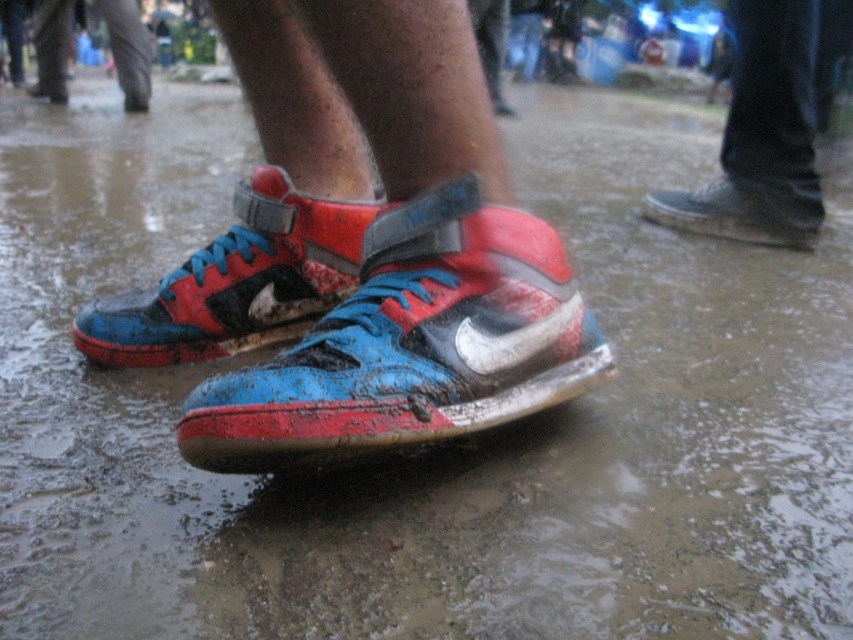
Between shiny leather sneakers at center and blue matte/suede sneaker at center, which one is positioned lower?

shiny leather sneakers at center is lower down.

Where is `shiny leather sneakers at center`? This screenshot has width=853, height=640. shiny leather sneakers at center is located at coordinates (412, 344).

Who is more distant from viewer, (x=372, y=221) or (x=231, y=333)?

The point (x=231, y=333) is behind.

Locate an element on the screen. shiny leather sneakers at center is located at coordinates [412, 344].

Is shiny leather sneakers at center smaller than blue suede shoe at upper right?

Incorrect, shiny leather sneakers at center is not smaller in size than blue suede shoe at upper right.

Based on the photo, can you confirm if shiny leather sneakers at center is shorter than blue suede shoe at upper right?

In fact, shiny leather sneakers at center may be taller than blue suede shoe at upper right.

This screenshot has height=640, width=853. I want to click on shiny leather sneakers at center, so click(x=412, y=344).

This screenshot has width=853, height=640. Describe the element at coordinates (236, 282) in the screenshot. I see `blue matte/suede sneaker at center` at that location.

Consider the image. Is blue matte/suede sneaker at center shorter than blue suede shoe at upper right?

No, blue matte/suede sneaker at center is not shorter than blue suede shoe at upper right.

The image size is (853, 640). Identify the location of blue matte/suede sneaker at center. (236, 282).